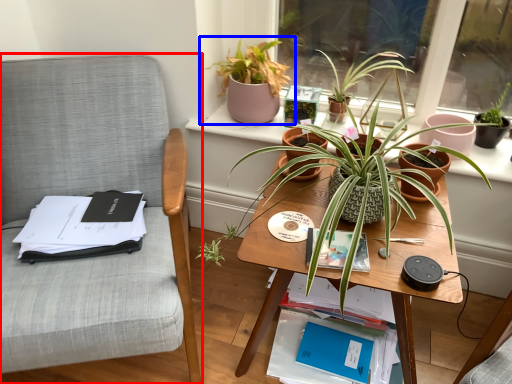
Question: Which object appears farthest to the camera in this image, chair (highlighted by a red box) or houseplant (highlighted by a blue box)?

Choices:
 (A) chair
 (B) houseplant

Answer: (B)